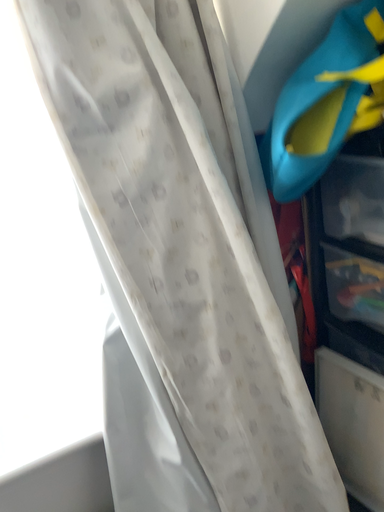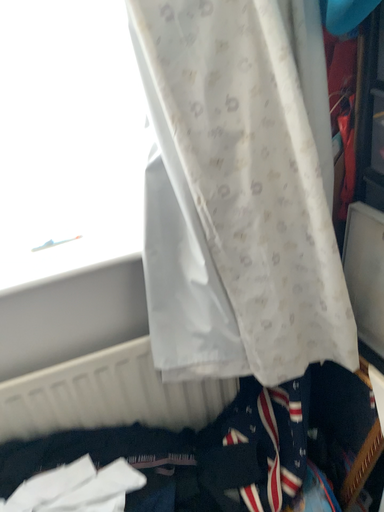
Question: Which way did the camera rotate in the video?

Choices:
 (A) rotated upward
 (B) rotated downward

Answer: (B)